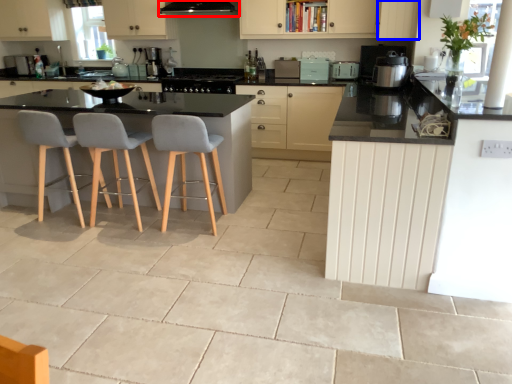
Question: Which object appears closest to the camera in this image, exhaust hood (highlighted by a red box) or cabinetry (highlighted by a blue box)?

Choices:
 (A) exhaust hood
 (B) cabinetry

Answer: (B)